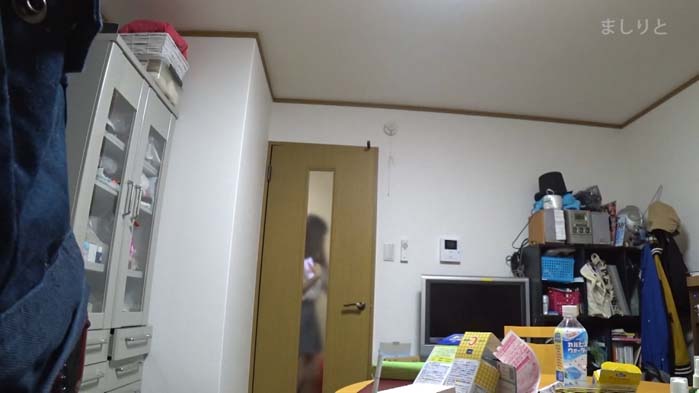
Locate an element on the screen. The width and height of the screenshot is (699, 393). cabinet is located at coordinates (108, 168), (158, 115).